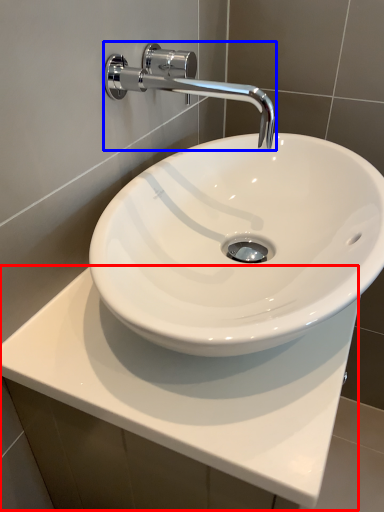
Question: Which object is further to the camera taking this photo, counter top (highlighted by a red box) or tap (highlighted by a blue box)?

Choices:
 (A) counter top
 (B) tap

Answer: (B)